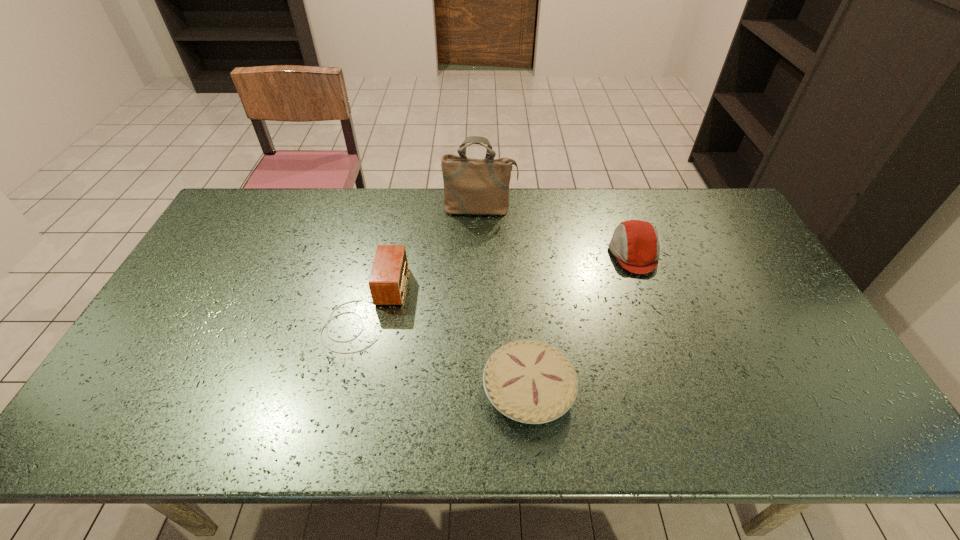
I want to click on free space that is in between the radio receiver and the rightmost object, so click(x=500, y=280).

What are the coordinates of `free space between the rightmost object and the tallest object` in the screenshot? It's located at (557, 232).

The height and width of the screenshot is (540, 960). I want to click on empty space between the farthest object and the rightmost object, so click(557, 232).

You are a GUI agent. You are given a task and a screenshot of the screen. Output one action in this format:
    pyautogui.click(x=<x>, y=<y>)
    Task: Click on the free space that is in between the leftmost object and the rightmost object
    
    Given the screenshot: What is the action you would take?
    pyautogui.click(x=500, y=280)

The width and height of the screenshot is (960, 540). In order to click on empty space between the pie and the tallest object in this screenshot , I will do `click(504, 299)`.

Where is `vacant space in between the cap and the pie`? vacant space in between the cap and the pie is located at coordinates (581, 322).

This screenshot has height=540, width=960. Find the location of `vacant area between the pie and the rightmost object`. vacant area between the pie and the rightmost object is located at coordinates (581, 322).

This screenshot has width=960, height=540. Find the location of `free area in between the cap and the tallest object`. free area in between the cap and the tallest object is located at coordinates (557, 232).

Select which object appears as the second closest to the farthest object. Please provide its 2D coordinates. Your answer should be formatted as a tuple, i.e. [(x, y)], where the tuple contains the x and y coordinates of a point satisfying the conditions above.

[(635, 244)]

Where is `object identified as the third closest to the farthest object`? Image resolution: width=960 pixels, height=540 pixels. object identified as the third closest to the farthest object is located at coordinates (529, 381).